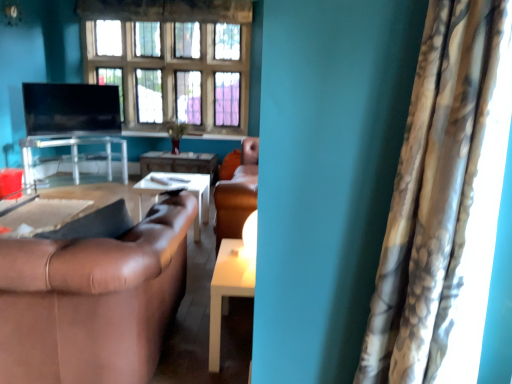
Question: Can you confirm if camouflage fabric curtain at right is shorter than wooden glossy table at center, the 2th table when ordered from left to right?

Choices:
 (A) yes
 (B) no

Answer: (B)

Question: From the image's perspective, would you say camouflage fabric curtain at right is shown under wooden glossy table at center, arranged as the 2th table when viewed from the top?

Choices:
 (A) no
 (B) yes

Answer: (B)

Question: Is camouflage fabric curtain at right outside wooden glossy table at center, arranged as the third table when viewed from the front?

Choices:
 (A) no
 (B) yes

Answer: (B)

Question: Is the depth of camouflage fabric curtain at right greater than that of wooden glossy table at center, placed as the 1th table when sorted from back to front?

Choices:
 (A) no
 (B) yes

Answer: (A)

Question: Is camouflage fabric curtain at right with wooden glossy table at center, the 2th table when ordered from left to right?

Choices:
 (A) no
 (B) yes

Answer: (A)

Question: In terms of width, does matte black tv at upper left look wider or thinner when compared to brown leather couch at lower left?

Choices:
 (A) thin
 (B) wide

Answer: (A)

Question: From their relative heights in the image, would you say matte black tv at upper left is taller or shorter than brown leather couch at lower left?

Choices:
 (A) tall
 (B) short

Answer: (B)

Question: Based on their positions, is matte black tv at upper left located to the left or right of brown leather couch at lower left?

Choices:
 (A) left
 (B) right

Answer: (A)

Question: From a real-world perspective, relative to brown leather couch at lower left, is matte black tv at upper left vertically above or below?

Choices:
 (A) above
 (B) below

Answer: (A)

Question: From their relative heights in the image, would you say camouflage fabric curtain at right is taller or shorter than white glossy table at center, placed as the 3th table when sorted from back to front?

Choices:
 (A) tall
 (B) short

Answer: (A)

Question: Visually, is camouflage fabric curtain at right positioned to the left or to the right of white glossy table at center, placed as the 3th table when sorted from back to front?

Choices:
 (A) left
 (B) right

Answer: (B)

Question: From a real-world perspective, is camouflage fabric curtain at right physically located above or below white glossy table at center, placed as the 3th table when sorted from back to front?

Choices:
 (A) above
 (B) below

Answer: (A)

Question: From the image's perspective, is camouflage fabric curtain at right located above or below white glossy table at center, arranged as the 3th table when viewed from the left?

Choices:
 (A) below
 (B) above

Answer: (B)

Question: In the image, is brown leather couch at lower left positioned in front of or behind white glossy table at center, arranged as the 3th table when viewed from the left?

Choices:
 (A) front
 (B) behind

Answer: (A)

Question: Visually, is brown leather couch at lower left positioned to the left or to the right of white glossy table at center, placed as the 1th table when sorted from front to back?

Choices:
 (A) left
 (B) right

Answer: (A)